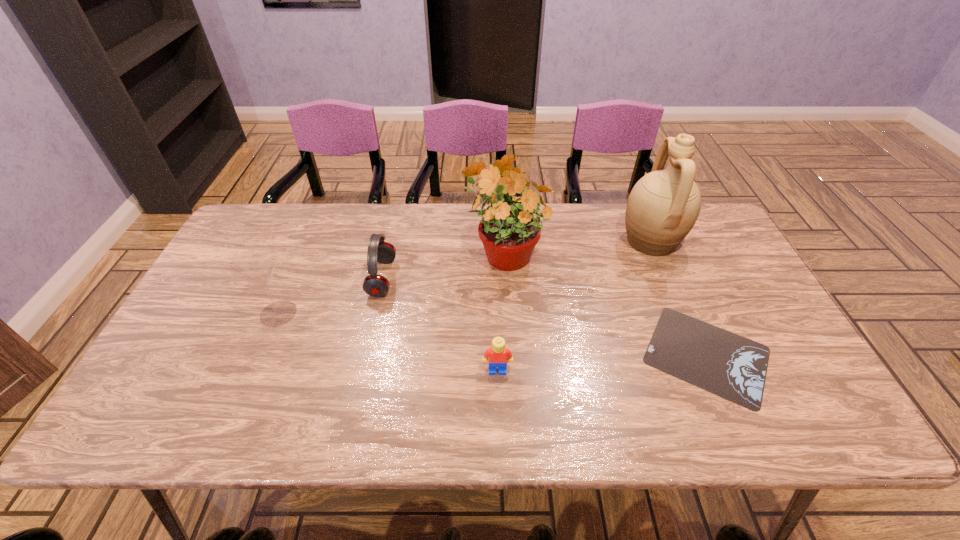
Find the location of `object positioned at the near right corner`. object positioned at the near right corner is located at coordinates (726, 364).

Find the location of `free space at the far edge of the desktop`. free space at the far edge of the desktop is located at coordinates (360, 245).

At what (x,y) coordinates should I click in order to perform the action: click on free space at the near edge. Please return your answer as a coordinate pair (x, y). This screenshot has height=540, width=960. Looking at the image, I should click on (418, 431).

Find the location of a particular element. The image size is (960, 540). vacant space at the left edge is located at coordinates (233, 287).

The height and width of the screenshot is (540, 960). What are the coordinates of `vacant area that lies between the mousepad and the leftmost object` in the screenshot? It's located at (492, 334).

Where is `vacant space that is in between the shortest object and the pitcher`? vacant space that is in between the shortest object and the pitcher is located at coordinates (679, 298).

Where is `vacant space that's between the fifth tallest object and the flowerpot`? vacant space that's between the fifth tallest object and the flowerpot is located at coordinates (500, 311).

I want to click on vacant area that lies between the second shortest object and the pitcher, so pyautogui.click(x=574, y=305).

Find the location of a particular element. This screenshot has width=960, height=540. unoccupied area between the fourth tallest object and the flowerpot is located at coordinates (443, 265).

Identify the location of vacant area that lies between the fourth tallest object and the second shortest object. [440, 324].